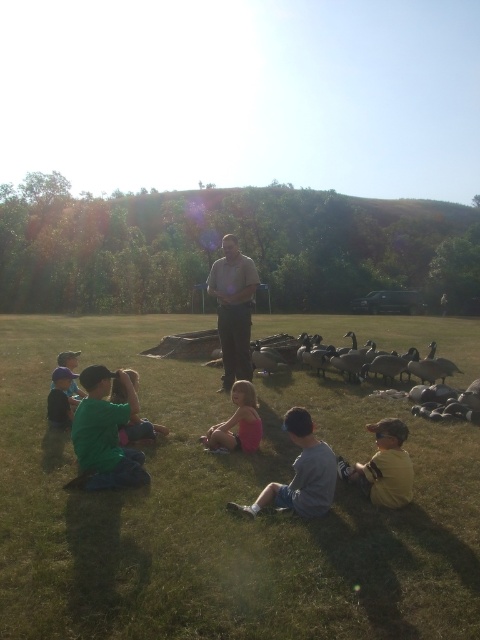
Question: Estimate the real-world distances between objects in this image. Which object is closer to the matte green shirt at lower left?

Choices:
 (A) pink fabric dress at center
 (B) light brown shirt at center

Answer: (B)

Question: Which point appears closest to the camera in this image?

Choices:
 (A) (16, 404)
 (B) (226, 388)
 (C) (60, 410)

Answer: (C)

Question: Can you confirm if yellow cotton shirt at lower right is positioned below green fabric shirt at lower left?

Choices:
 (A) no
 (B) yes

Answer: (B)

Question: Can you confirm if green matte shirt at lower left is positioned to the left of green cotton shirt at lower left?

Choices:
 (A) yes
 (B) no

Answer: (B)

Question: Based on their relative distances, which object is farther from the green cotton shirt at lower left?

Choices:
 (A) light brown shirt at center
 (B) dark gray feathers at center
 (C) green grass at center
 (D) yellow cotton shirt at lower right

Answer: (B)

Question: Does green cotton shirt at lower left appear under dark gray feathers at center?

Choices:
 (A) no
 (B) yes

Answer: (B)